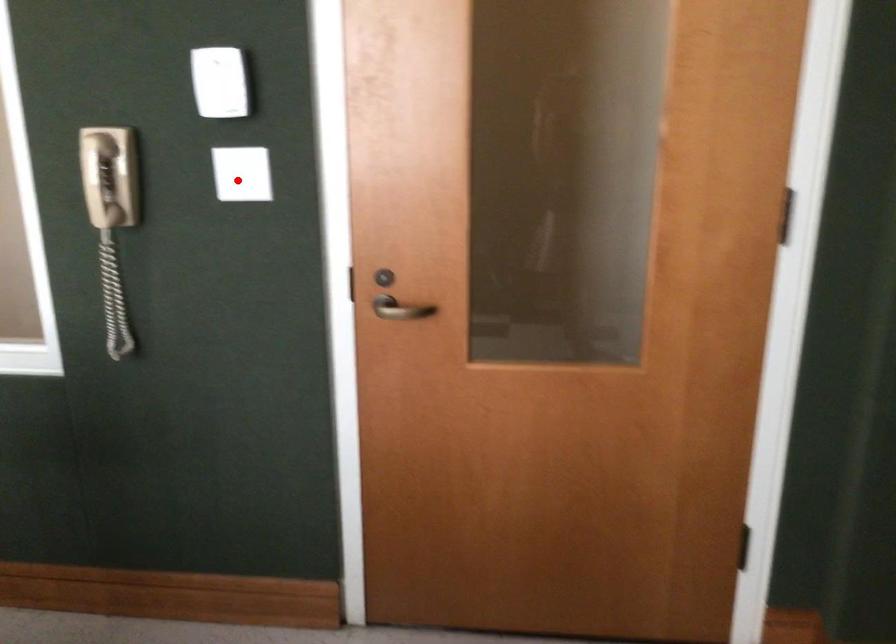
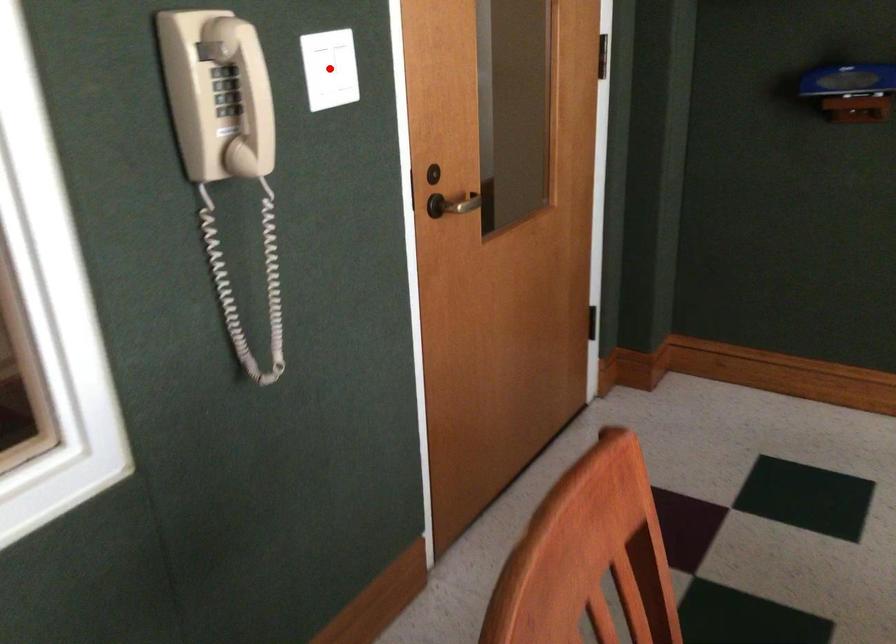
I am providing you with two images of the same scene from different viewpoints. A red point is marked on the first image and another point is marked on the second image. Is the red point in image1 aligned with the point shown in image2?

Yes